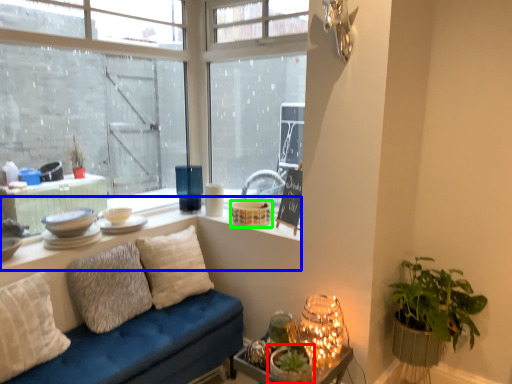
Question: Which object is positioned closest to houseplant (highlighted by a red box)? Select from window (highlighted by a blue box) and candle holder (highlighted by a green box).

Choices:
 (A) window
 (B) candle holder

Answer: (A)